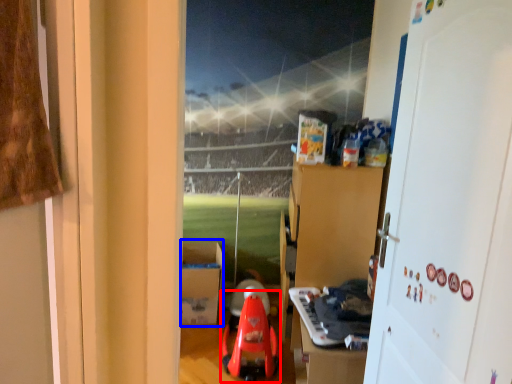
Question: Which of the following is the farthest to the observer, toy (highlighted by a red box) or cardboard box (highlighted by a blue box)?

Choices:
 (A) toy
 (B) cardboard box

Answer: (B)